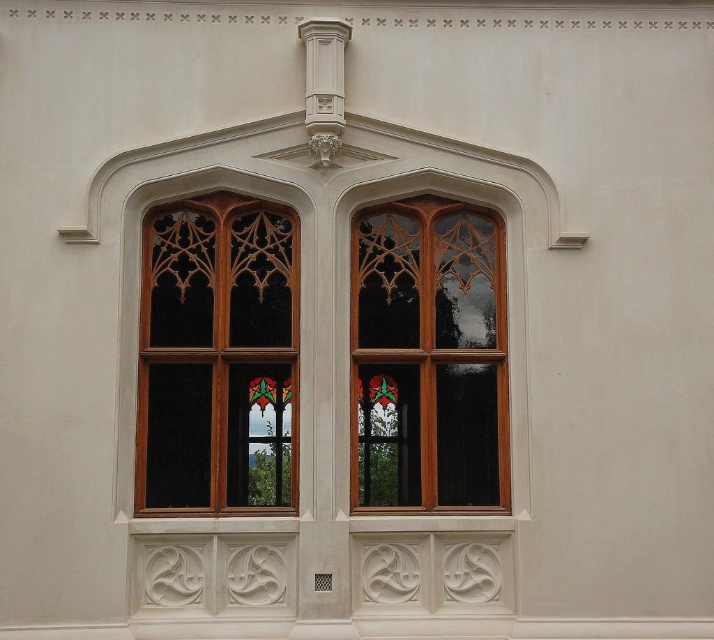
What is located at the point with coordinates (218, 356) in the image?

The point at (218, 356) indicates clear stained glass at left.

You are an architect reviewing a building facade. You notice two points marked on the wall. The first point is at coordinate point (283, 456) and the second is at point (478, 259). Based on the facade description, which point is closer to the viewer?

Point (283, 456) is in front of point (478, 259), so the first point is closer to the viewer.